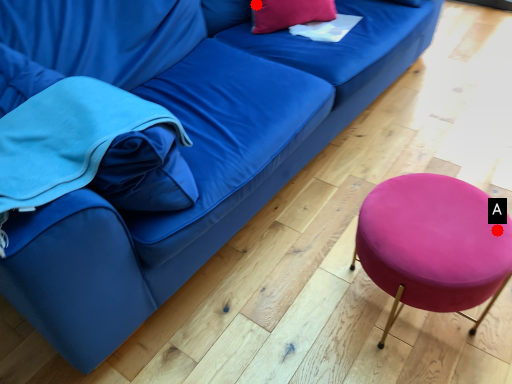
Question: Two points are circled on the image, labeled by A and B beside each circle. Which point is closer to the camera?

Choices:
 (A) A is closer
 (B) B is closer

Answer: (A)